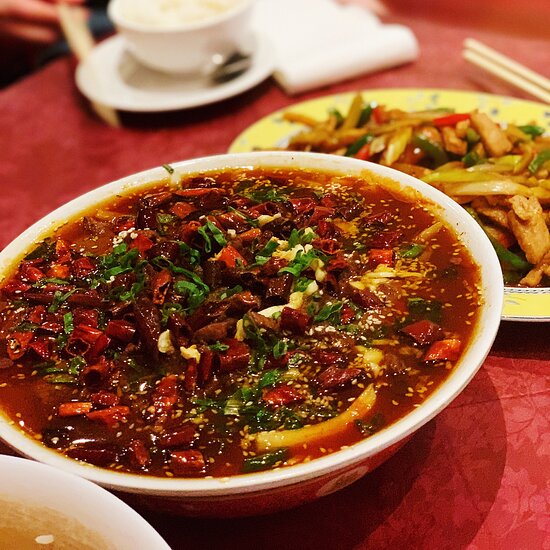
Find the location of a particular element. Image resolution: width=550 pixels, height=550 pixels. dish of stir fry is located at coordinates (471, 176).